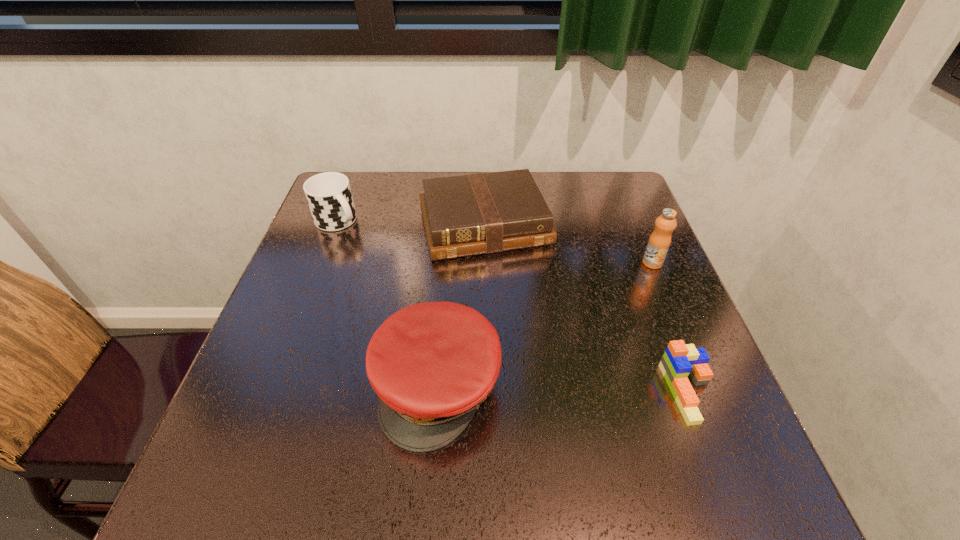
The width and height of the screenshot is (960, 540). Identify the location of Lego that is at the right edge. (679, 360).

Find the location of `orange juice at the right edge`. orange juice at the right edge is located at coordinates (659, 242).

At what (x,y) coordinates should I click in order to perform the action: click on object that is at the far left corner. Please return your answer as a coordinate pair (x, y). The image size is (960, 540). Looking at the image, I should click on (329, 196).

Where is `object present at the near right corner`? object present at the near right corner is located at coordinates (679, 360).

The height and width of the screenshot is (540, 960). I want to click on free region at the far edge, so click(x=404, y=208).

The width and height of the screenshot is (960, 540). In the image, there is a desktop. In order to click on vacant region at the left edge in this screenshot , I will do `click(364, 256)`.

Find the location of a particular element. The image size is (960, 540). vacant space at the right edge is located at coordinates (628, 248).

Find the location of a particular element. This screenshot has width=960, height=540. free region at the far left corner of the desktop is located at coordinates (361, 173).

Image resolution: width=960 pixels, height=540 pixels. I want to click on free space at the far right corner of the desktop, so click(592, 202).

Where is `free space between the cup and the cap`? free space between the cup and the cap is located at coordinates (388, 304).